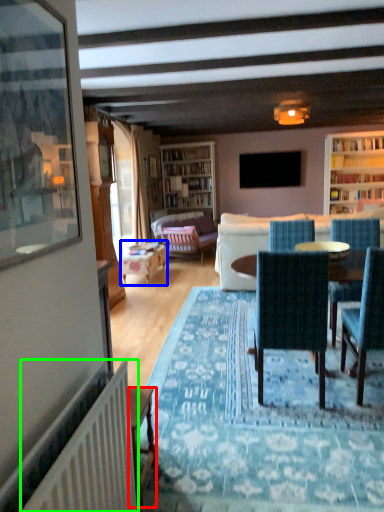
Question: Which object is the closest to the desk (highlighted by a red box)? Choose among these: table (highlighted by a blue box) or radiator (highlighted by a green box).

Choices:
 (A) table
 (B) radiator

Answer: (B)